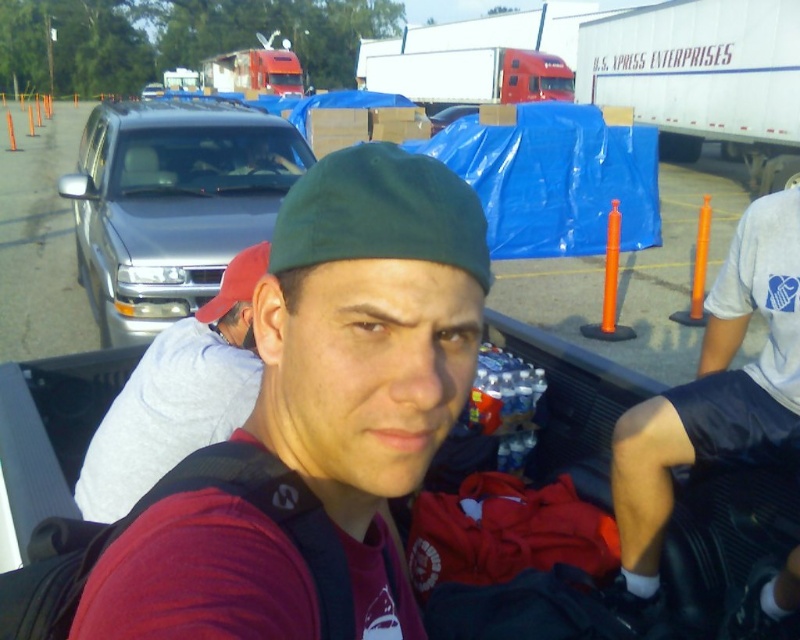
You are standing at the origin point of the image coordinate system. The red fabric cap at center is located at point (236, 282). If you want to move towards the red fabric cap at center, in which direction should you move?

The red fabric cap at center is located at point (236, 282). Since the coordinate system is normalized, moving towards the positive x and y directions from the origin would lead you to the red fabric cap at center.

You are a pedestrian standing at the truck stop and see the red fabric cap at center and the matte black truck driver at upper center. Which object is nearer to you?

The red fabric cap at center is closer to the viewer than the matte black truck driver at upper center.

From the picture: You are standing at the truck stop and want to determine which of the two points, point (701, 29) or point (256, 145), is closer to you. Based on the scene, which point is nearer?

Point (701, 29) is closer to you because it is further to the viewer than point (256, 145).